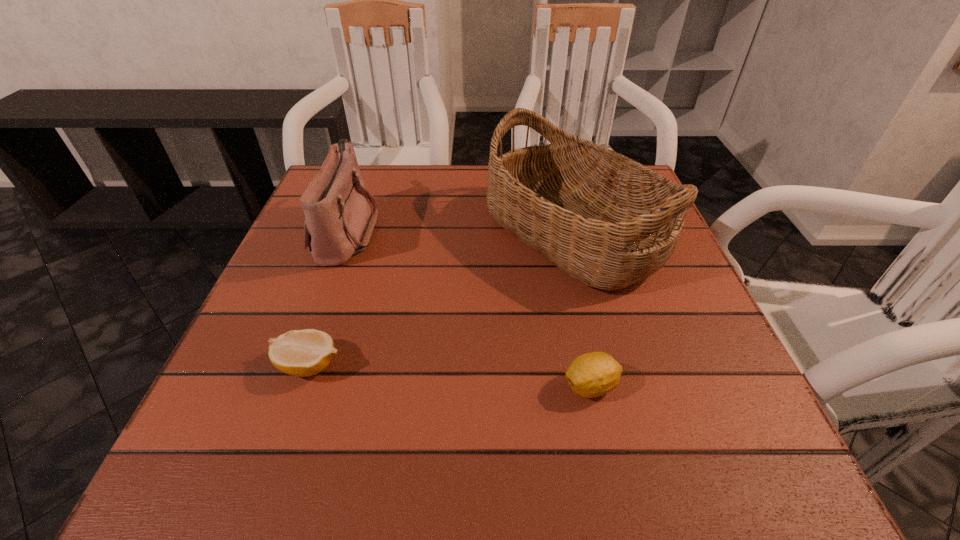
Find the location of a particular element. This screenshot has height=540, width=960. basket is located at coordinates (608, 221).

The image size is (960, 540). What are the coordinates of `shoulder bag` in the screenshot? It's located at (338, 223).

This screenshot has width=960, height=540. In order to click on the right lemon in this screenshot , I will do `click(590, 375)`.

Identify the location of the taller lemon. (x=590, y=375).

Where is `the left lemon`? The image size is (960, 540). the left lemon is located at coordinates (303, 353).

Identify the location of the shortest object. (303, 353).

The image size is (960, 540). I want to click on vacant region located on the left of the tallest object, so click(423, 233).

Locate an element on the screen. vacant region located on the front pocket of the shoulder bag is located at coordinates (x=408, y=231).

Where is `free point located at the stem end of the second shortest object`? This screenshot has height=540, width=960. free point located at the stem end of the second shortest object is located at coordinates (454, 386).

I want to click on vacant space positioned at the stem end of the second shortest object, so click(365, 386).